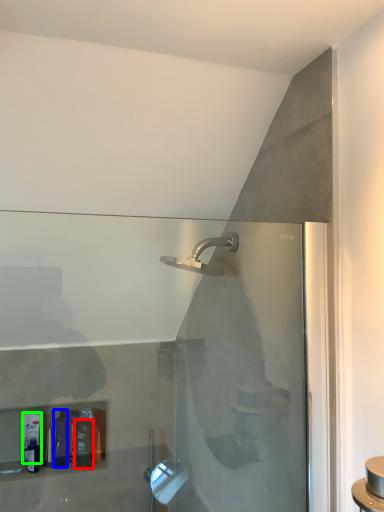
Question: Which object is the closest to the toiletry (highlighted by a red box)? Choose among these: toiletry (highlighted by a blue box) or toiletry (highlighted by a green box).

Choices:
 (A) toiletry
 (B) toiletry

Answer: (A)